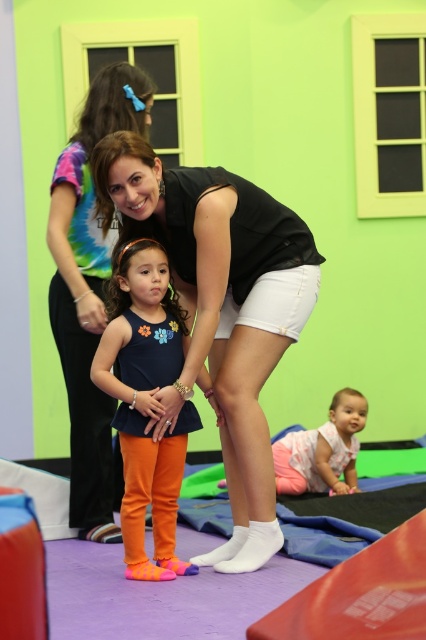
You are a photographer trying to capture a closeup shot of the black matte tank top at center and the matte orange leggings at center. Which one should you focus on first to ensure it is in sharp focus?

The black matte tank top at center is closer to the viewer than the matte orange leggings at center, so you should focus on the black matte tank top at center first to ensure it is in sharp focus.

You are a photographer standing at the back of the play area. You want to take a photo of the matte orange leggings at center and the pink cotton baby at lower center so that both are in the frame. Given that your camera has a minimum focus distance of 1.5 meters, will you be able to capture both subjects clearly without moving closer?

The matte orange leggings at center and pink cotton baby at lower center are 1.78 meters apart. Since the distance between them is greater than the camera minimum focus distance of 1.5 meters, the photographer can capture both subjects clearly without moving closer.